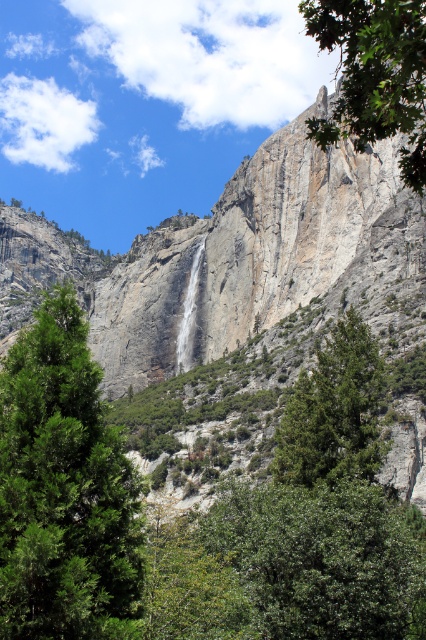
Can you confirm if gray rock cliff at center is taller than green leafy tree at upper right?

No.

Between point (389, 291) and point (393, 124), which one is positioned in front?

Point (393, 124) is in front.

You are a GUI agent. You are given a task and a screenshot of the screen. Output one action in this format:
    pyautogui.click(x=<x>, y=<y>)
    Task: Click on the gray rock cliff at center
    The height and width of the screenshot is (640, 426).
    Given the screenshot: What is the action you would take?
    pyautogui.click(x=238, y=259)

You are a GUI agent. You are given a task and a screenshot of the screen. Output one action in this format:
    pyautogui.click(x=<x>, y=<y>)
    Task: Click on the gray rock cliff at center
    
    Given the screenshot: What is the action you would take?
    pyautogui.click(x=238, y=259)

Is green leafy tree at center closer to the viewer compared to green leafy tree at upper right?

No, green leafy tree at center is further to the viewer.

Who is higher up, green leafy tree at center or green leafy tree at upper right?

green leafy tree at upper right is higher up.

Identify the location of green leafy tree at center. (63, 490).

Is gray rock cliff at center thinner than green leafy tree at center?

No, gray rock cliff at center is not thinner than green leafy tree at center.

Based on the photo, does gray rock cliff at center have a larger size compared to green leafy tree at center?

Correct, gray rock cliff at center is larger in size than green leafy tree at center.

Is point (120, 278) less distant than point (23, 600)?

No, (120, 278) is further to viewer.

At what (x,y) coordinates should I click in order to perform the action: click on gray rock cliff at center. Please return your answer as a coordinate pair (x, y). The width and height of the screenshot is (426, 640). Looking at the image, I should click on (238, 259).